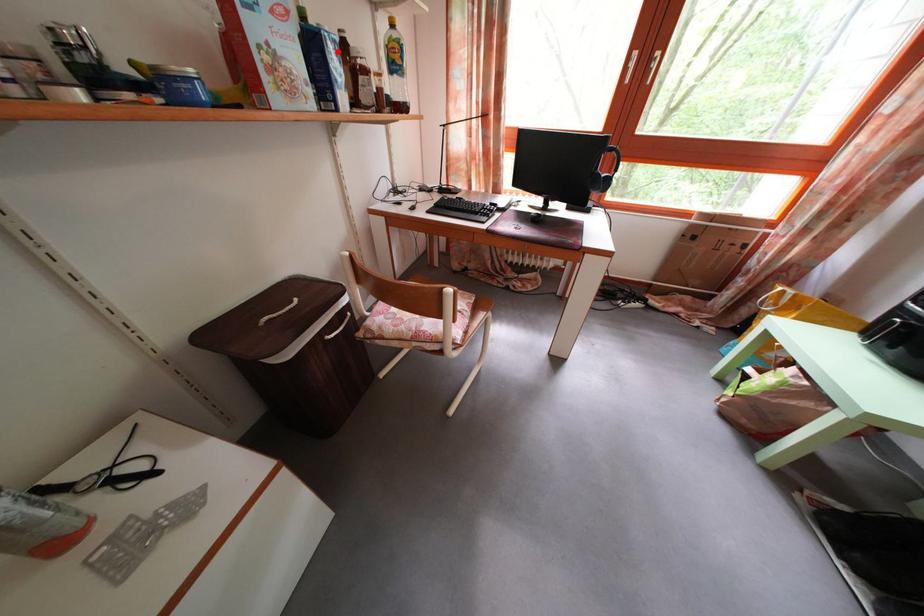
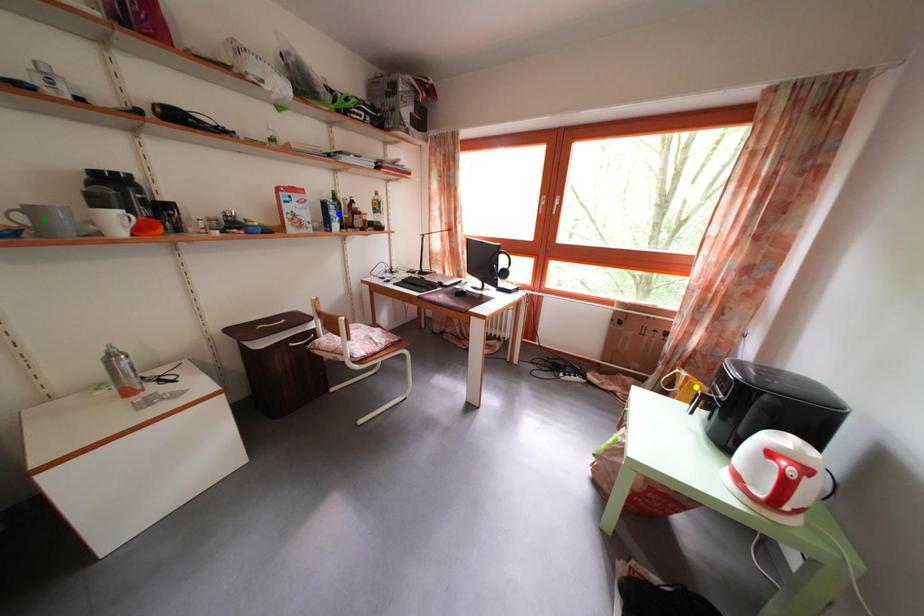
Question: I am providing you with two images of the same scene from different viewpoints. A red point is marked on the first image. You are given multiple points on the second image. In image 2, which mark is for the same physical point as the one in image 1?

Choices:
 (A) yellow point
 (B) green point
 (C) blue point

Answer: (C)